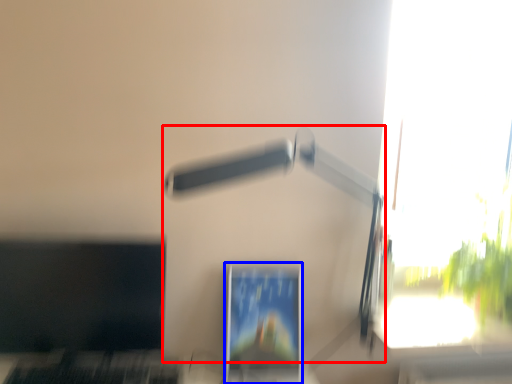
Question: Among these objects, which one is farthest to the camera, lamp (highlighted by a red box) or computer monitor (highlighted by a blue box)?

Choices:
 (A) lamp
 (B) computer monitor

Answer: (B)